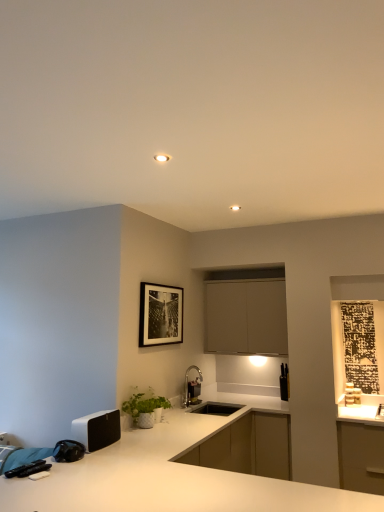
Describe the element at coordinates (97, 429) in the screenshot. The height and width of the screenshot is (512, 384). I see `white matte speaker at lower left, placed as the third appliance when sorted from right to left` at that location.

In order to click on white glossy countertop at center in this screenshot , I will do `click(171, 476)`.

What do you see at coordinates (193, 392) in the screenshot? I see `metallic silver faucet at center, positioned as the second appliance in left-to-right order` at bounding box center [193, 392].

In order to click on black matte picture frame at upper center in this screenshot , I will do `click(160, 315)`.

This screenshot has height=512, width=384. Describe the element at coordinates (284, 383) in the screenshot. I see `black matte knife block at right, the 1th appliance in the right-to-left sequence` at that location.

This screenshot has width=384, height=512. I want to click on white matte speaker at lower left, the first appliance when ordered from left to right, so click(97, 429).

Can you confirm if white ceramic plant at lower center is bigger than metallic silver faucet at center, positioned as the second appliance in left-to-right order?

Yes, white ceramic plant at lower center is bigger than metallic silver faucet at center, positioned as the second appliance in left-to-right order.

Can you confirm if white ceramic plant at lower center is wider than metallic silver faucet at center, positioned as the second appliance in left-to-right order?

Correct, the width of white ceramic plant at lower center exceeds that of metallic silver faucet at center, positioned as the second appliance in left-to-right order.

Is point (122, 406) closer to camera compared to point (188, 388)?

Yes.

Is white ceramic plant at lower center located outside metallic silver faucet at center, the 2th appliance when ordered from right to left?

Indeed, white ceramic plant at lower center is completely outside metallic silver faucet at center, the 2th appliance when ordered from right to left.

Can you confirm if metallic silver faucet at center, the 2th appliance when ordered from right to left, is smaller than white ceramic plant at lower center?

Correct, metallic silver faucet at center, the 2th appliance when ordered from right to left, occupies less space than white ceramic plant at lower center.

From the picture: From the image's perspective, is metallic silver faucet at center, arranged as the second appliance when viewed from the front, above or below white ceramic plant at lower center?

Based on their image positions, metallic silver faucet at center, arranged as the second appliance when viewed from the front, is located beneath white ceramic plant at lower center.

Is metallic silver faucet at center, arranged as the second appliance when viewed from the front, positioned behind white ceramic plant at lower center?

Yes.

Who is taller, metallic silver faucet at center, arranged as the second appliance when viewed from the front, or white ceramic plant at lower center?

white ceramic plant at lower center.

Is white matte speaker at lower left, placed as the third appliance when sorted from right to left, behind brushed metal faucet at lower center?

No, it is in front of brushed metal faucet at lower center.

Between white matte speaker at lower left, the first appliance when ordered from left to right, and brushed metal faucet at lower center, which one appears on the right side from the viewer's perspective?

From the viewer's perspective, brushed metal faucet at lower center appears more on the right side.

This screenshot has height=512, width=384. Find the location of `tap below the white matte speaker at lower left, placed as the third appliance when sorted from right to left (from the image's perspective)`. tap below the white matte speaker at lower left, placed as the third appliance when sorted from right to left (from the image's perspective) is located at coordinates (192, 387).

I want to click on appliance that is the 2nd one when counting forward from the matte white cabinet at center, so click(97, 429).

Is white matte speaker at lower left, the 1th appliance positioned from the front, to the left of matte white cabinet at center from the viewer's perspective?

Yes, white matte speaker at lower left, the 1th appliance positioned from the front, is to the left of matte white cabinet at center.

Is white matte speaker at lower left, placed as the third appliance when sorted from right to left, bigger than matte white cabinet at center?

No, white matte speaker at lower left, placed as the third appliance when sorted from right to left, is not bigger than matte white cabinet at center.

You are a GUI agent. You are given a task and a screenshot of the screen. Output one action in this format:
    pyautogui.click(x=<x>, y=<y>)
    Task: Click on the tap that is under the black matte knife block at right, which appears as the third appliance when viewed from the front (from a real-world perspective)
    This screenshot has height=512, width=384.
    Given the screenshot: What is the action you would take?
    pyautogui.click(x=192, y=387)

Which object is positioned more to the left, brushed metal faucet at lower center or black matte knife block at right, arranged as the first appliance when viewed from the back?

From the viewer's perspective, brushed metal faucet at lower center appears more on the left side.

Considering the positions of points (187, 391) and (285, 395), is point (187, 391) farther from camera compared to point (285, 395)?

No, (187, 391) is closer to viewer.

Which of these two, brushed metal faucet at lower center or black matte knife block at right, arranged as the first appliance when viewed from the back, stands taller?

Answer: Standing taller between the two is black matte knife block at right, arranged as the first appliance when viewed from the back.

In the scene shown: From the image's perspective, which is above, white glossy countertop at center or white matte speaker at lower left, placed as the third appliance when sorted from right to left?

white matte speaker at lower left, placed as the third appliance when sorted from right to left.

Find the location of a particular element. Image resolution: width=384 pixels, height=512 pixels. countertop that is under the white matte speaker at lower left, placed as the third appliance when sorted from right to left (from a real-world perspective) is located at coordinates (171, 476).

Which is behind, point (127, 460) or point (105, 423)?

Point (105, 423)

Can you tell me how much brushed metal faucet at lower center and matte white cabinet at center differ in facing direction?

brushed metal faucet at lower center and matte white cabinet at center are facing 89.9 degrees away from each other.

Is brushed metal faucet at lower center bigger or smaller than matte white cabinet at center?

Clearly, brushed metal faucet at lower center is smaller in size than matte white cabinet at center.

Between brushed metal faucet at lower center and matte white cabinet at center, which one has less height?

brushed metal faucet at lower center is shorter.

Is brushed metal faucet at lower center completely or partially outside of matte white cabinet at center?

brushed metal faucet at lower center is positioned outside matte white cabinet at center.

From a real-world perspective, count 1st appliances downward from the white ceramic plant at lower center and point to it. Please provide its 2D coordinates.

[(193, 392)]

The image size is (384, 512). Find the location of `plant located on the left of metallic silver faucet at center, arranged as the second appliance when viewed from the front`. plant located on the left of metallic silver faucet at center, arranged as the second appliance when viewed from the front is located at coordinates (143, 403).

When comparing their distances from black matte picture frame at upper center, does white ceramic plant at lower center or metallic silver faucet at center, the 2th appliance positioned from the back, seem further?

metallic silver faucet at center, the 2th appliance positioned from the back.

Based on their spatial positions, is white ceramic plant at lower center or white glossy countertop at center further from white matte speaker at lower left, the first appliance when ordered from left to right?

white ceramic plant at lower center lies further to white matte speaker at lower left, the first appliance when ordered from left to right, than the other object.

Considering their positions, is metallic silver faucet at center, the 2th appliance positioned from the back, positioned closer to black matte picture frame at upper center than matte white cabinet at center?

metallic silver faucet at center, the 2th appliance positioned from the back, is positioned closer to the anchor black matte picture frame at upper center.

When comparing their distances from metallic silver faucet at center, the 2th appliance positioned from the back, does black matte knife block at right, which appears as the third appliance when viewed from the front, or black matte picture frame at upper center seem closer?

black matte picture frame at upper center lies closer to metallic silver faucet at center, the 2th appliance positioned from the back, than the other object.

Considering their positions, is brushed metal faucet at lower center positioned closer to black matte knife block at right, which appears as the third appliance when viewed from the front, than white glossy countertop at center?

brushed metal faucet at lower center is closer to black matte knife block at right, which appears as the third appliance when viewed from the front.

Looking at this image, looking at the image, which one is located closer to metallic silver faucet at center, positioned as the second appliance in left-to-right order, white matte speaker at lower left, the first appliance when ordered from left to right, or black matte knife block at right, the 1th appliance in the right-to-left sequence?

The object closer to metallic silver faucet at center, positioned as the second appliance in left-to-right order, is black matte knife block at right, the 1th appliance in the right-to-left sequence.

From the image, which object appears to be nearer to metallic silver faucet at center, the 2th appliance when ordered from right to left, white glossy countertop at center or brushed metal faucet at lower center?

brushed metal faucet at lower center is closer to metallic silver faucet at center, the 2th appliance when ordered from right to left.

From the picture: When comparing their distances from matte white cabinet at center, does metallic silver faucet at center, positioned as the second appliance in left-to-right order, or white ceramic plant at lower center seem closer?

metallic silver faucet at center, positioned as the second appliance in left-to-right order, is positioned closer to the anchor matte white cabinet at center.

In order to click on appliance between black matte picture frame at upper center and black matte knife block at right, which appears as the third appliance when viewed from the front, in the horizontal direction in this screenshot , I will do `click(193, 392)`.

You are a GUI agent. You are given a task and a screenshot of the screen. Output one action in this format:
    pyautogui.click(x=<x>, y=<y>)
    Task: Click on the tap that lies between black matte picture frame at upper center and metallic silver faucet at center, the 2th appliance positioned from the back, from top to bottom
    The height and width of the screenshot is (512, 384).
    Given the screenshot: What is the action you would take?
    pyautogui.click(x=192, y=387)

You are a GUI agent. You are given a task and a screenshot of the screen. Output one action in this format:
    pyautogui.click(x=<x>, y=<y>)
    Task: Click on the cabinetry between white ceramic plant at lower center and black matte knife block at right, the third appliance viewed from the left, in the horizontal direction
    This screenshot has width=384, height=512.
    Given the screenshot: What is the action you would take?
    pyautogui.click(x=246, y=317)

I want to click on picture frame between white ceramic plant at lower center and metallic silver faucet at center, the 2th appliance when ordered from right to left, from front to back, so click(160, 315).